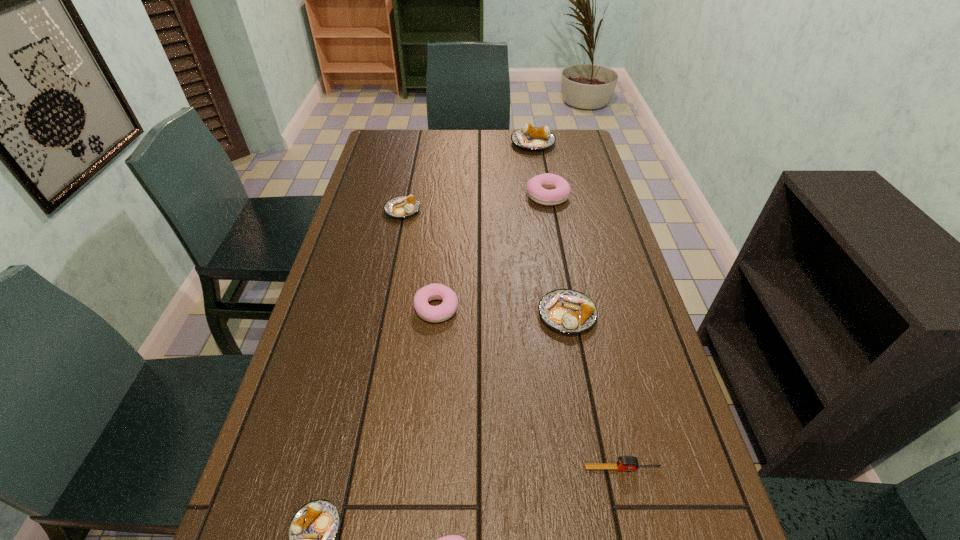
Where is `vacant space at the left edge of the desktop`? The width and height of the screenshot is (960, 540). vacant space at the left edge of the desktop is located at coordinates (365, 198).

At what (x,y) coordinates should I click in order to perform the action: click on free space at the right edge of the desktop. Please return your answer as a coordinate pair (x, y). This screenshot has height=540, width=960. Looking at the image, I should click on (683, 442).

Where is `vacant space in between the third smallest brown pastry and the biggest brown pastry`? This screenshot has height=540, width=960. vacant space in between the third smallest brown pastry and the biggest brown pastry is located at coordinates (550, 229).

The height and width of the screenshot is (540, 960). What are the coordinates of `free spot between the farthest brown pastry and the second smallest brown pastry` in the screenshot? It's located at (468, 177).

You are a GUI agent. You are given a task and a screenshot of the screen. Output one action in this format:
    pyautogui.click(x=<x>, y=<y>)
    Task: Click on the vacant area between the second smallest pink pastry and the sixth farthest object
    The width and height of the screenshot is (960, 540).
    Given the screenshot: What is the action you would take?
    pyautogui.click(x=530, y=388)

Where is `vacant area that lies between the third nearest object and the second farthest pink pastry`? This screenshot has width=960, height=540. vacant area that lies between the third nearest object and the second farthest pink pastry is located at coordinates (530, 388).

Where is `object that ranks as the seventh closest to the smallest brown pastry`? The width and height of the screenshot is (960, 540). object that ranks as the seventh closest to the smallest brown pastry is located at coordinates (531, 138).

The width and height of the screenshot is (960, 540). I want to click on object that is the sixth nearest to the farthest pastry, so click(312, 531).

Where is `pastry that is the nearest to the third biggest brown pastry`? The height and width of the screenshot is (540, 960). pastry that is the nearest to the third biggest brown pastry is located at coordinates (444, 311).

Locate an element on the screen. The width and height of the screenshot is (960, 540). the fourth closest pastry relative to the tape measure is located at coordinates (312, 531).